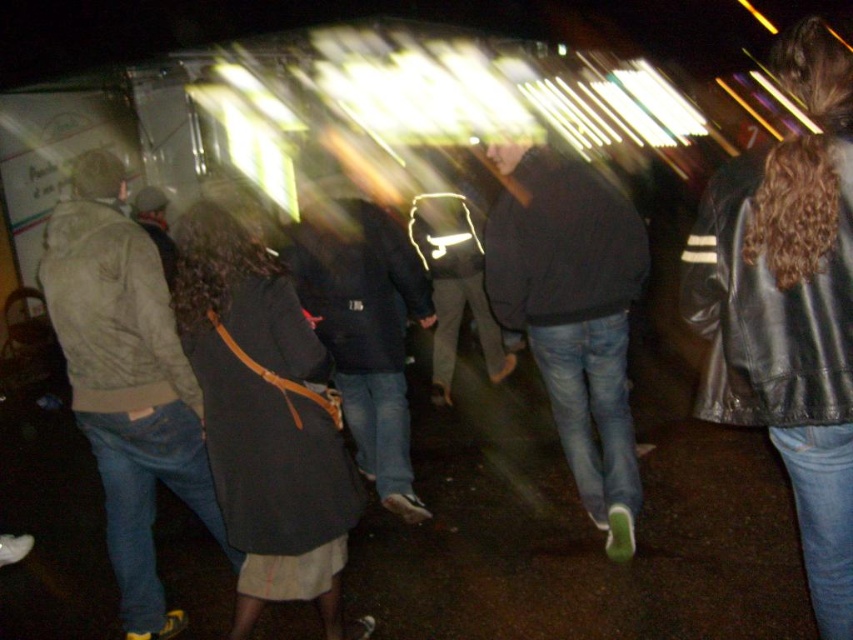
Question: Which of the following is the closest to the observer?

Choices:
 (A) dark blue jacket at center
 (B) black leather jacket at right

Answer: (B)

Question: Is black leather jacket at right behind light brown leather jacket at left?

Choices:
 (A) yes
 (B) no

Answer: (B)

Question: Can you confirm if dark gray coat at center is smaller than dark blue jacket at center?

Choices:
 (A) yes
 (B) no

Answer: (A)

Question: Can you confirm if black leather jacket at right is positioned to the right of dark blue jacket at center?

Choices:
 (A) no
 (B) yes

Answer: (B)

Question: Based on their relative distances, which object is nearer to the dark gray coat at center?

Choices:
 (A) light brown leather jacket at left
 (B) dark blue jeans at center

Answer: (A)

Question: Which point is farther to the camera?

Choices:
 (A) dark blue jacket at center
 (B) light brown leather jacket at left
 (C) black leather jacket at right

Answer: (A)